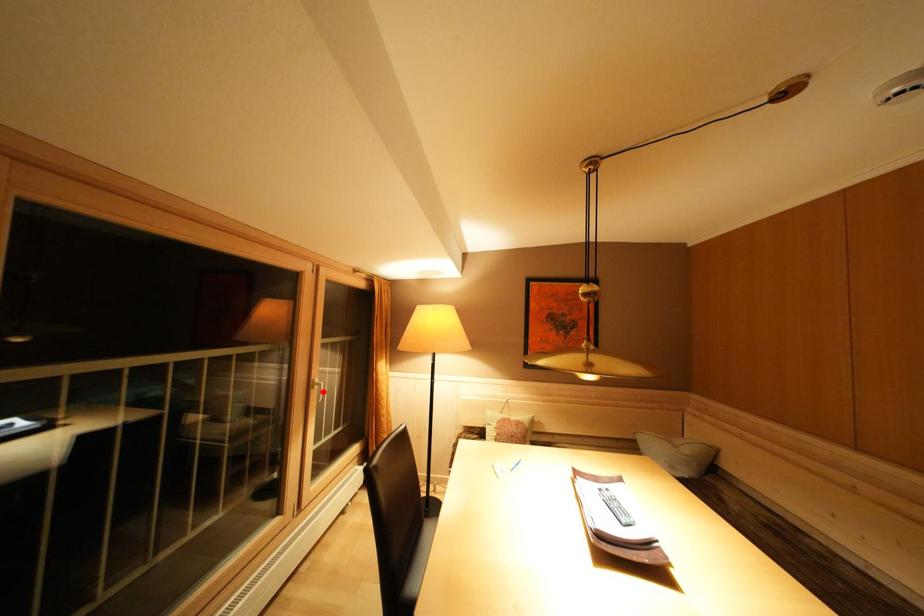
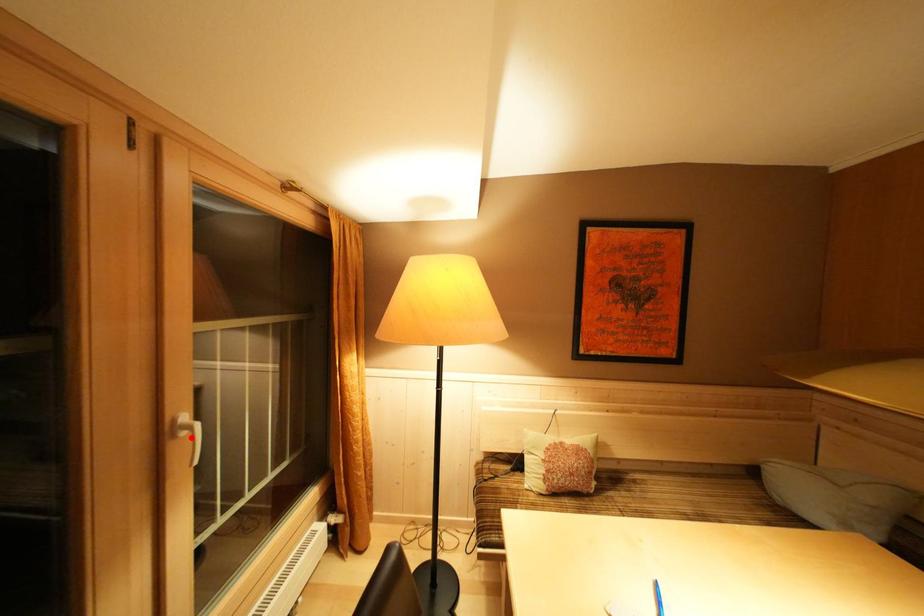
Looking at this image, I am providing you with two images of the same scene from different viewpoints. A red point is marked on the first image and another point is marked on the second image. Is the red point in image1 aligned with the point shown in image2?

Yes